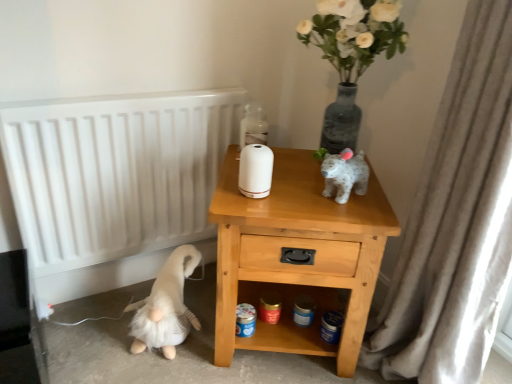
Question: Is translucent glass bottle at upper center wider or thinner than light wood/texture nightstand at center?

Choices:
 (A) wide
 (B) thin

Answer: (B)

Question: Would you say translucent glass bottle at upper center is inside or outside light wood/texture nightstand at center?

Choices:
 (A) inside
 (B) outside

Answer: (B)

Question: Estimate the real-world distances between objects in this image. Which object is closer to the white plush gnome at lower left?

Choices:
 (A) translucent glass bottle at upper center
 (B) white textured curtain at right
 (C) white matte radiator at left
 (D) light wood/texture nightstand at center

Answer: (C)

Question: Considering the real-world distances, which object is closest to the light wood/texture nightstand at center?

Choices:
 (A) white matte radiator at left
 (B) white textured curtain at right
 (C) translucent glass bottle at upper center
 (D) white plush gnome at lower left

Answer: (B)